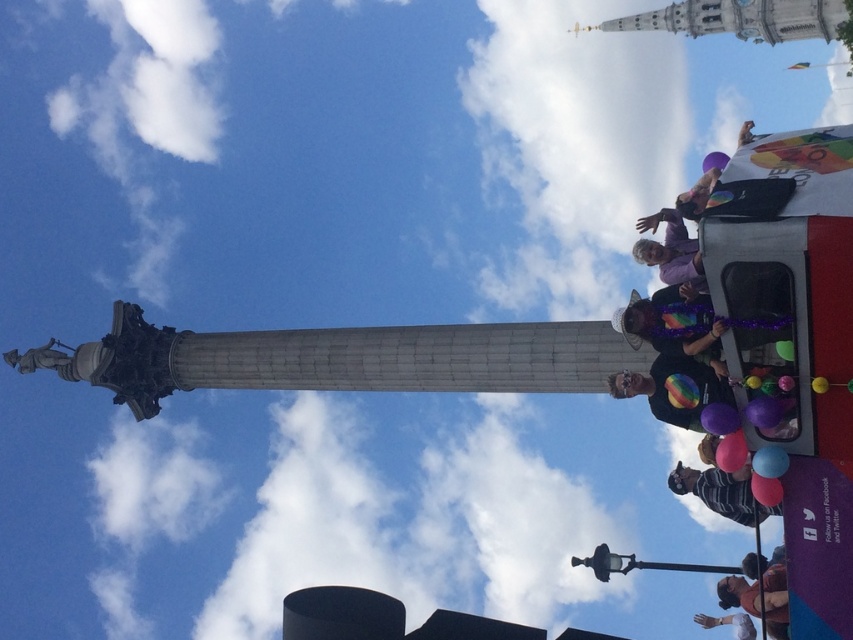
Question: Which is farther from the purple glossy balloon at upper right?

Choices:
 (A) striped cotton shirt at lower right
 (B) rubber balloon at lower right

Answer: (A)

Question: Which point is farther from the camera taking this photo?

Choices:
 (A) (720, 432)
 (B) (775, 504)
 (C) (671, 234)

Answer: (C)

Question: Does striped cotton shirt at lower right appear on the right side of purple glossy balloon at upper right?

Choices:
 (A) no
 (B) yes

Answer: (B)

Question: Which object is the farthest from the purple matte shirt at upper right?

Choices:
 (A) matte blue balloon at lower right
 (B) rubber balloon at lower right
 (C) purple glossy balloon at upper right
 (D) striped cotton shirt at lower right

Answer: (B)

Question: Is striped cotton shirt at lower right wider than purple glossy balloon at upper right?

Choices:
 (A) yes
 (B) no

Answer: (A)

Question: Can you confirm if purple glossy balloon at upper right is positioned above rubber balloon at lower right?

Choices:
 (A) yes
 (B) no

Answer: (A)